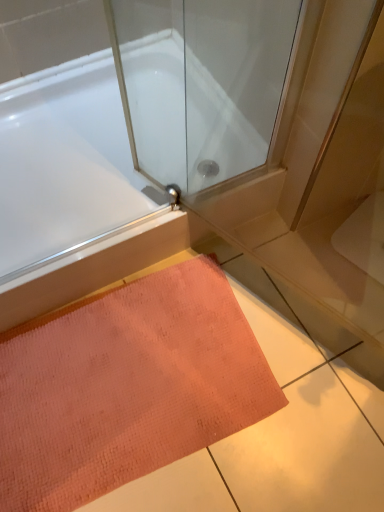
Question: Is orange textured mat at lower center wider or thinner than white glossy bathtub at upper left?

Choices:
 (A) wide
 (B) thin

Answer: (B)

Question: In terms of size, does orange textured mat at lower center appear bigger or smaller than white glossy bathtub at upper left?

Choices:
 (A) small
 (B) big

Answer: (A)

Question: In the image, is orange textured mat at lower center positioned in front of or behind white glossy bathtub at upper left?

Choices:
 (A) behind
 (B) front

Answer: (B)

Question: Considering the positions of white glossy bathtub at upper left and orange textured mat at lower center in the image, is white glossy bathtub at upper left wider or thinner than orange textured mat at lower center?

Choices:
 (A) thin
 (B) wide

Answer: (B)

Question: Is white glossy bathtub at upper left taller or shorter than orange textured mat at lower center?

Choices:
 (A) short
 (B) tall

Answer: (B)

Question: From the image's perspective, relative to orange textured mat at lower center, is white glossy bathtub at upper left above or below?

Choices:
 (A) above
 (B) below

Answer: (A)

Question: Considering their positions, is white glossy bathtub at upper left located in front of or behind orange textured mat at lower center?

Choices:
 (A) behind
 (B) front

Answer: (A)